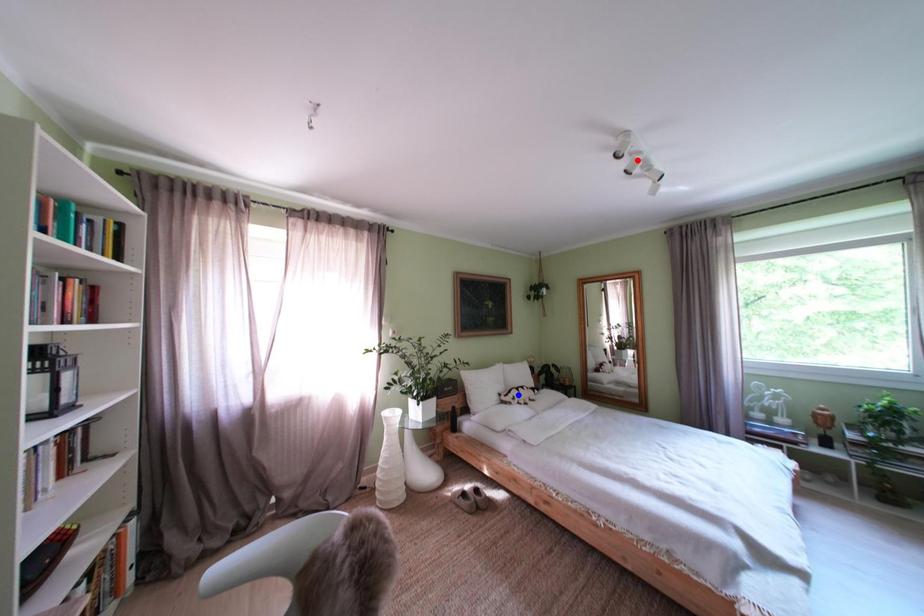
Question: Which of the two points in the image is closer to the camera?

Choices:
 (A) Blue point is closer.
 (B) Red point is closer.

Answer: (B)